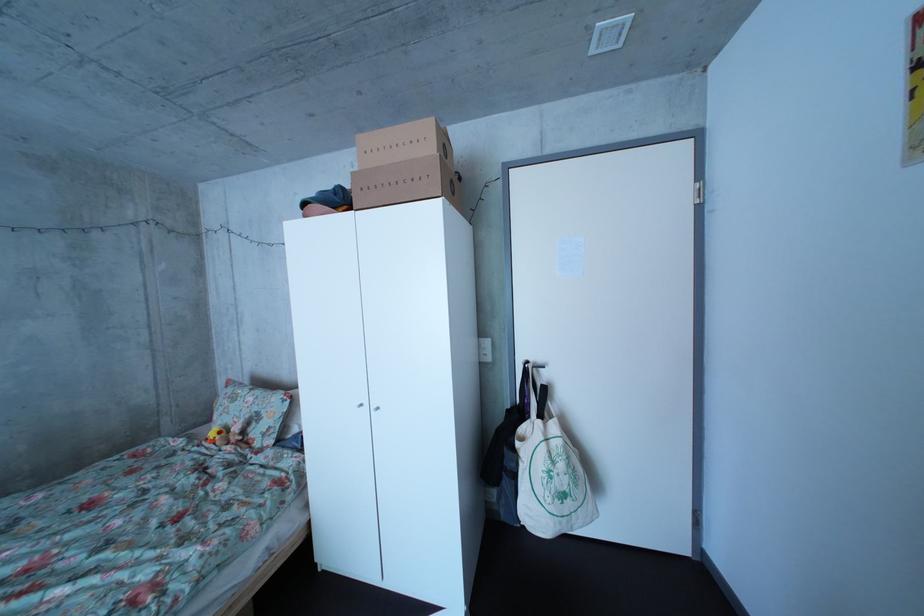
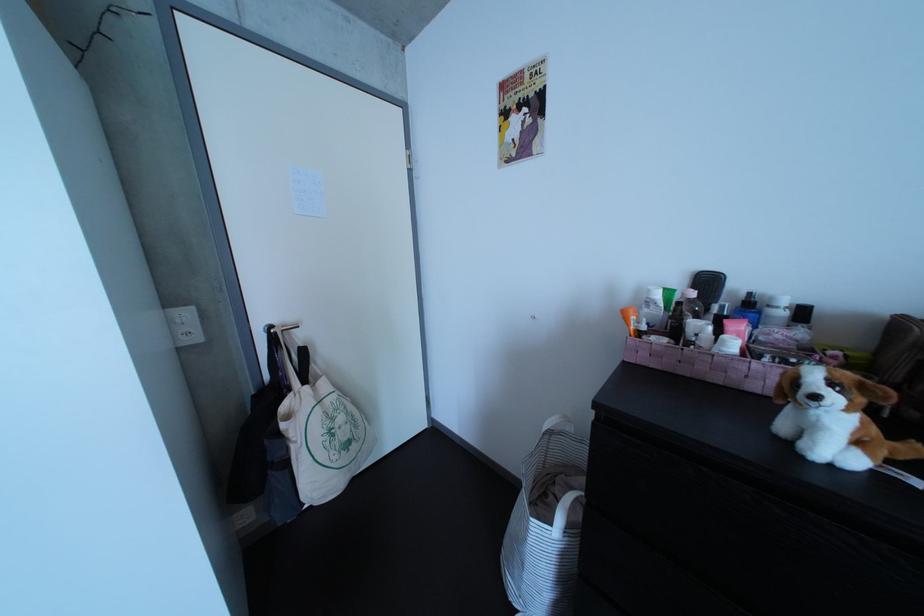
Where in the second image is the point corresponding to the point at 576,474 from the first image?

(355, 426)